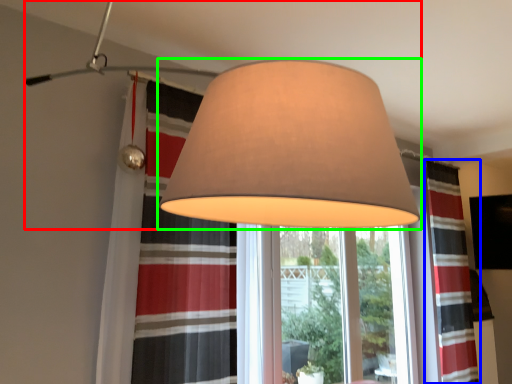
Question: Which object is positioned farthest from lamp (highlighted by a red box)? Select from curtain (highlighted by a blue box) and lamp (highlighted by a green box).

Choices:
 (A) curtain
 (B) lamp

Answer: (A)